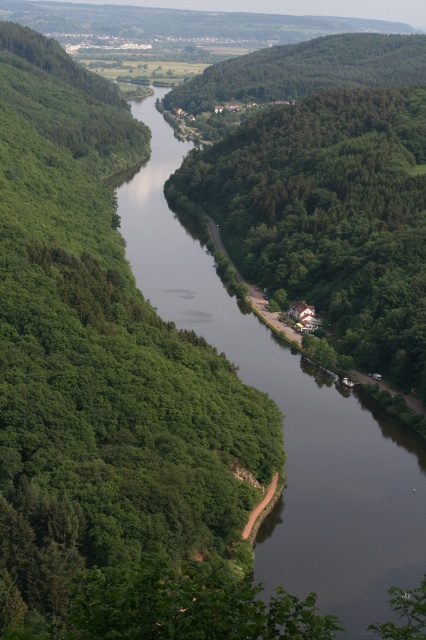
Who is positioned more to the left, green leafy tree at center or dark reflective water at center?

From the viewer's perspective, dark reflective water at center appears more on the left side.

Does green leafy tree at center appear on the right side of dark reflective water at center?

Yes, green leafy tree at center is to the right of dark reflective water at center.

Which is behind, point (247, 164) or point (423, 570)?

Positioned behind is point (247, 164).

This screenshot has height=640, width=426. I want to click on green leafy tree at center, so click(x=328, y=214).